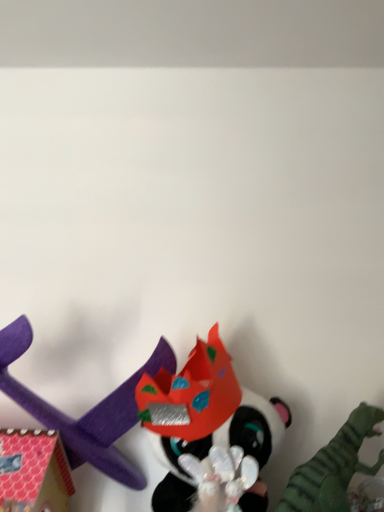
Question: Is point (129, 479) closer or farther from the camera than point (329, 475)?

Choices:
 (A) closer
 (B) farther

Answer: (B)

Question: Considering their positions, is purple foam airplane at lower left, which appears as the 1th toy when viewed from the left, located in front of or behind shiny plastic mask at center, the first toy in the right-to-left sequence?

Choices:
 (A) front
 (B) behind

Answer: (B)

Question: Estimate the real-world distances between objects in this image. Which object is farther from the shiny red paper crown at center, which ranks as the 2th toy in left-to-right order?

Choices:
 (A) shiny plastic mask at center, the first toy in the right-to-left sequence
 (B) purple foam airplane at lower left, the third toy positioned from the right

Answer: (A)

Question: Estimate the real-world distances between objects in this image. Which object is closer to the shiny red paper crown at center, acting as the 2th toy starting from the right?

Choices:
 (A) shiny plastic mask at center, the 3th toy viewed from the left
 (B) purple foam airplane at lower left, which appears as the 1th toy when viewed from the left

Answer: (B)